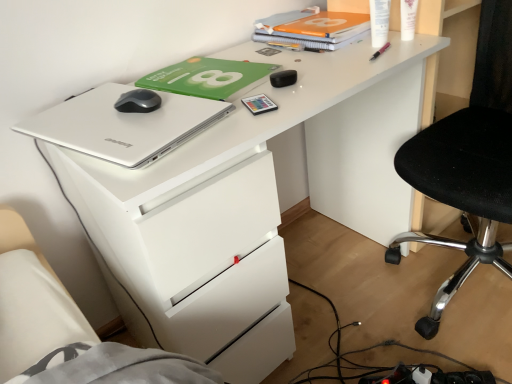
Question: Is silver metallic laptop at upper left further to camera compared to black mesh chair at right?

Choices:
 (A) no
 (B) yes

Answer: (B)

Question: Considering the relative sizes of silver metallic laptop at upper left and black mesh chair at right in the image provided, is silver metallic laptop at upper left bigger than black mesh chair at right?

Choices:
 (A) yes
 (B) no

Answer: (B)

Question: From the image's perspective, is silver metallic laptop at upper left above black mesh chair at right?

Choices:
 (A) yes
 (B) no

Answer: (A)

Question: Is silver metallic laptop at upper left positioned far away from black mesh chair at right?

Choices:
 (A) yes
 (B) no

Answer: (B)

Question: Is the surface of silver metallic laptop at upper left in direct contact with black mesh chair at right?

Choices:
 (A) yes
 (B) no

Answer: (B)

Question: Could black mesh chair at right be considered to be inside silver metallic laptop at upper left?

Choices:
 (A) no
 (B) yes

Answer: (A)

Question: Is silver metallic laptop at upper left to the left of orange matte notebook at upper center from the viewer's perspective?

Choices:
 (A) yes
 (B) no

Answer: (A)

Question: Considering the relative sizes of silver metallic laptop at upper left and orange matte notebook at upper center in the image provided, is silver metallic laptop at upper left shorter than orange matte notebook at upper center?

Choices:
 (A) yes
 (B) no

Answer: (A)

Question: Is silver metallic laptop at upper left to the right of orange matte notebook at upper center from the viewer's perspective?

Choices:
 (A) yes
 (B) no

Answer: (B)

Question: Does silver metallic laptop at upper left have a greater width compared to orange matte notebook at upper center?

Choices:
 (A) yes
 (B) no

Answer: (A)

Question: From the image's perspective, does silver metallic laptop at upper left appear lower than orange matte notebook at upper center?

Choices:
 (A) yes
 (B) no

Answer: (A)

Question: Does silver metallic laptop at upper left have a greater height compared to orange matte notebook at upper center?

Choices:
 (A) no
 (B) yes

Answer: (A)

Question: Can you see matte plastic card at center, acting as the fifth stationery starting from the top, touching orange matte notebook at upper center?

Choices:
 (A) no
 (B) yes

Answer: (A)